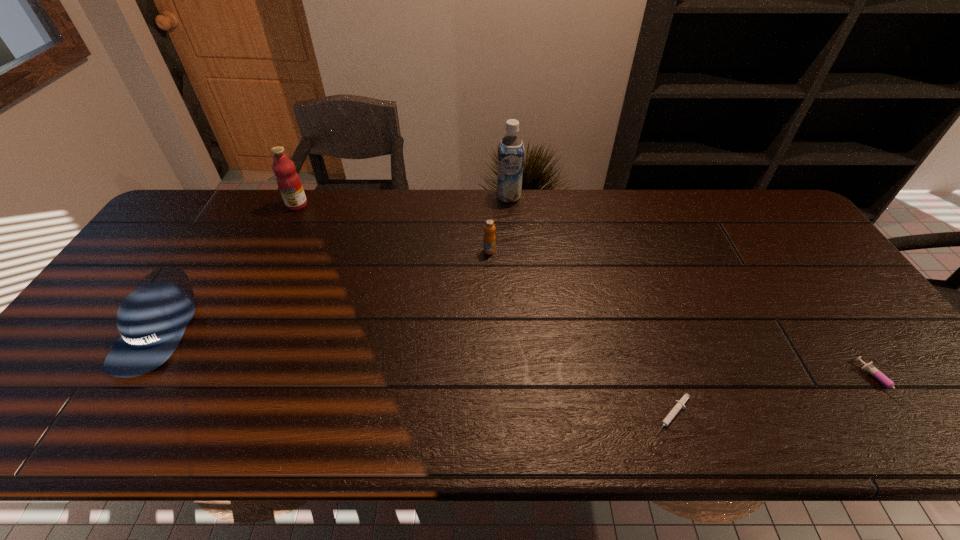
At what (x,y) coordinates should I click in order to perform the action: click on the shortest object. Please return your answer as a coordinate pair (x, y). Image resolution: width=960 pixels, height=540 pixels. Looking at the image, I should click on (679, 404).

I want to click on vacant point located on the label of the tallest object, so click(x=512, y=238).

This screenshot has height=540, width=960. I want to click on vacant space located on the label of the fifth shortest object, so click(287, 225).

You are a GUI agent. You are given a task and a screenshot of the screen. Output one action in this format:
    pyautogui.click(x=<x>, y=<y>)
    Task: Click on the vacant space positioned 0.110m on the front label of the third object from left to right
    This screenshot has width=960, height=540.
    Given the screenshot: What is the action you would take?
    pyautogui.click(x=491, y=282)

The width and height of the screenshot is (960, 540). What are the coordinates of `vacant region located on the front-facing side of the leftmost object` in the screenshot? It's located at (110, 403).

The height and width of the screenshot is (540, 960). Find the location of `free spot located on the left of the right syringe`. free spot located on the left of the right syringe is located at coordinates (740, 383).

Locate an element on the screen. Image resolution: width=960 pixels, height=540 pixels. free space located 0.350m on the right of the second object from right to left is located at coordinates (856, 415).

I want to click on soya milk that is positioned at the far edge, so click(x=511, y=148).

Image resolution: width=960 pixels, height=540 pixels. In order to click on fruit juice present at the far edge in this screenshot , I will do `click(288, 180)`.

Locate an element on the screen. This screenshot has width=960, height=540. object present at the left edge is located at coordinates (152, 319).